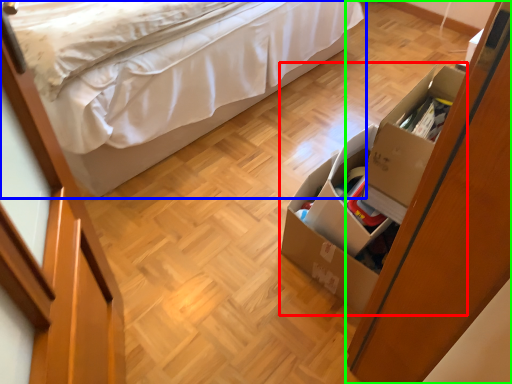
Question: Which object is positioned closest to storage box (highlighted by a red box)? Select from bed (highlighted by a blue box) and dresser (highlighted by a green box).

Choices:
 (A) bed
 (B) dresser

Answer: (B)